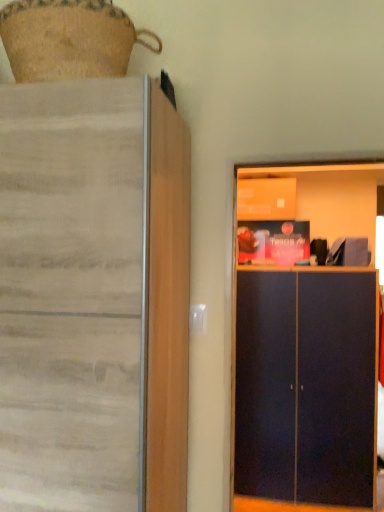
Question: Is matte wood cupboard at left closer to camera compared to dark blue matte cabinet at right?

Choices:
 (A) no
 (B) yes

Answer: (B)

Question: Can you confirm if matte wood cupboard at left is positioned to the left of dark blue matte cabinet at right?

Choices:
 (A) no
 (B) yes

Answer: (B)

Question: Would you say dark blue matte cabinet at right is part of matte wood cupboard at left's contents?

Choices:
 (A) no
 (B) yes

Answer: (A)

Question: Is matte wood cupboard at left smaller than dark blue matte cabinet at right?

Choices:
 (A) no
 (B) yes

Answer: (A)

Question: From a real-world perspective, is matte wood cupboard at left located beneath dark blue matte cabinet at right?

Choices:
 (A) yes
 (B) no

Answer: (B)

Question: Can you confirm if matte wood cupboard at left is thinner than dark blue matte cabinet at right?

Choices:
 (A) yes
 (B) no

Answer: (B)

Question: Does dark blue matte cabinet at right appear on the left side of matte wood cupboard at left?

Choices:
 (A) yes
 (B) no

Answer: (B)

Question: Does dark blue matte cabinet at right turn towards matte wood cupboard at left?

Choices:
 (A) yes
 (B) no

Answer: (B)

Question: From the image's perspective, is dark blue matte cabinet at right over matte wood cupboard at left?

Choices:
 (A) yes
 (B) no

Answer: (B)

Question: From a real-world perspective, does dark blue matte cabinet at right stand above matte wood cupboard at left?

Choices:
 (A) yes
 (B) no

Answer: (B)

Question: Is dark blue matte cabinet at right directly adjacent to matte wood cupboard at left?

Choices:
 (A) no
 (B) yes

Answer: (A)

Question: Can you confirm if dark blue matte cabinet at right is taller than matte wood cupboard at left?

Choices:
 (A) yes
 (B) no

Answer: (B)

Question: In the image, is dark blue matte cabinet at right on the left side or the right side of matte wood cupboard at left?

Choices:
 (A) right
 (B) left

Answer: (A)